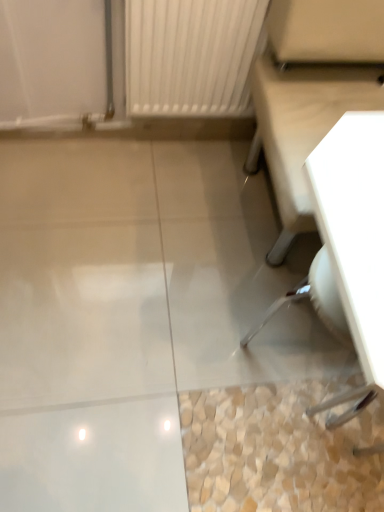
Where is `clear plastic swivel chair at lower right`? clear plastic swivel chair at lower right is located at coordinates (314, 300).

What do you see at coordinates (314, 300) in the screenshot? The height and width of the screenshot is (512, 384). I see `clear plastic swivel chair at lower right` at bounding box center [314, 300].

What do you see at coordinates (302, 127) in the screenshot?
I see `white glossy table at upper right` at bounding box center [302, 127].

I want to click on white glossy table at upper right, so click(302, 127).

Where is `clear plastic swivel chair at lower right`? clear plastic swivel chair at lower right is located at coordinates (314, 300).

Would you say white glossy table at upper right is to the left or to the right of clear plastic swivel chair at lower right in the picture?

white glossy table at upper right is to the right of clear plastic swivel chair at lower right.

In the image, is white glossy table at upper right positioned in front of or behind clear plastic swivel chair at lower right?

In the image, white glossy table at upper right appears in front of clear plastic swivel chair at lower right.

Which is in front, point (320, 128) or point (324, 253)?

The point (324, 253) is in front.

From the image's perspective, which object appears higher, white glossy table at upper right or clear plastic swivel chair at lower right?

From the image's view, white glossy table at upper right is above.

From a real-world perspective, which is physically above, white glossy table at upper right or clear plastic swivel chair at lower right?

From a 3D spatial view, white glossy table at upper right is above.

Which object is thinner, white glossy table at upper right or clear plastic swivel chair at lower right?

With smaller width is clear plastic swivel chair at lower right.

Does white glossy table at upper right have a lesser height compared to clear plastic swivel chair at lower right?

Incorrect, the height of white glossy table at upper right does not fall short of that of clear plastic swivel chair at lower right.

Which of these two, white glossy table at upper right or clear plastic swivel chair at lower right, is smaller?

Smaller between the two is clear plastic swivel chair at lower right.

Would you say white glossy table at upper right is inside or outside clear plastic swivel chair at lower right?

white glossy table at upper right is not inside clear plastic swivel chair at lower right, it's outside.

Would you say white glossy table at upper right is a long distance from clear plastic swivel chair at lower right?

They are positioned close to each other.

Is white glossy table at upper right turned away from clear plastic swivel chair at lower right?

That's not correct — white glossy table at upper right is not looking away from clear plastic swivel chair at lower right.

Identify the location of furniture above the clear plastic swivel chair at lower right (from a real-world perspective). (302, 127).

Is clear plastic swivel chair at lower right to the left of white glossy table at upper right from the viewer's perspective?

Correct, you'll find clear plastic swivel chair at lower right to the left of white glossy table at upper right.

Does clear plastic swivel chair at lower right lie behind white glossy table at upper right?

Yes, it is behind white glossy table at upper right.

Considering the points (345, 322) and (276, 168), which point is behind, point (345, 322) or point (276, 168)?

The point (276, 168) is farther.

From the image's perspective, is clear plastic swivel chair at lower right located beneath white glossy table at upper right?

Yes.

From a real-world perspective, who is located lower, clear plastic swivel chair at lower right or white glossy table at upper right?

clear plastic swivel chair at lower right is physically lower.

Which object is wider, clear plastic swivel chair at lower right or white glossy table at upper right?

With larger width is white glossy table at upper right.

Between clear plastic swivel chair at lower right and white glossy table at upper right, which one has less height?

clear plastic swivel chair at lower right.

Between clear plastic swivel chair at lower right and white glossy table at upper right, which one has smaller size?

Smaller between the two is clear plastic swivel chair at lower right.

Is white glossy table at upper right located within clear plastic swivel chair at lower right?

No, white glossy table at upper right is located outside of clear plastic swivel chair at lower right.

Are clear plastic swivel chair at lower right and white glossy table at upper right far apart?

No, clear plastic swivel chair at lower right is not far away from white glossy table at upper right.

Is clear plastic swivel chair at lower right facing away from white glossy table at upper right?

clear plastic swivel chair at lower right does not have its back to white glossy table at upper right.

How much distance is there between clear plastic swivel chair at lower right and white glossy table at upper right?

clear plastic swivel chair at lower right and white glossy table at upper right are 45.20 centimeters apart.

Identify the location of furniture in front of the clear plastic swivel chair at lower right. This screenshot has width=384, height=512. coord(302,127).

The height and width of the screenshot is (512, 384). Identify the location of furniture that is above the clear plastic swivel chair at lower right (from the image's perspective). (302, 127).

Where is `swivel chair behind the white glossy table at upper right`? This screenshot has height=512, width=384. swivel chair behind the white glossy table at upper right is located at coordinates (314, 300).